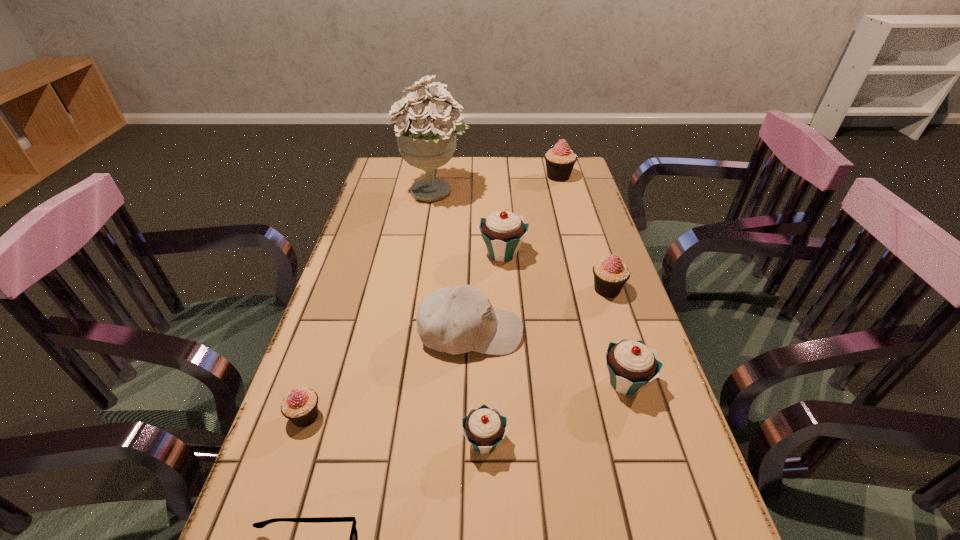
Locate which object is the second closest to the second smallest pink cupcake. Please provide its 2D coordinates. Your answer should be formatted as a tuple, i.e. [(x, y)], where the tuple contains the x and y coordinates of a point satisfying the conditions above.

[(457, 319)]

Identify which cupcake is the third closest to the biggest teal cupcake. Please provide its 2D coordinates. Your answer should be formatted as a tuple, i.e. [(x, y)], where the tuple contains the x and y coordinates of a point satisfying the conditions above.

[(560, 160)]

Where is `the second closest cupcake to the nearest teal cupcake`? the second closest cupcake to the nearest teal cupcake is located at coordinates (300, 406).

This screenshot has height=540, width=960. Identify the location of the closest pink cupcake to the biggest teal cupcake. (610, 274).

Point out which pink cupcake is positioned as the nearest to the seventh nearest object. Please provide its 2D coordinates. Your answer should be formatted as a tuple, i.e. [(x, y)], where the tuple contains the x and y coordinates of a point satisfying the conditions above.

[(610, 274)]

Locate which teal cupcake is the third closest to the black spectacles. Please provide its 2D coordinates. Your answer should be formatted as a tuple, i.e. [(x, y)], where the tuple contains the x and y coordinates of a point satisfying the conditions above.

[(502, 231)]

What are the coordinates of `the closest teal cupcake to the second smallest pink cupcake` in the screenshot? It's located at (502, 231).